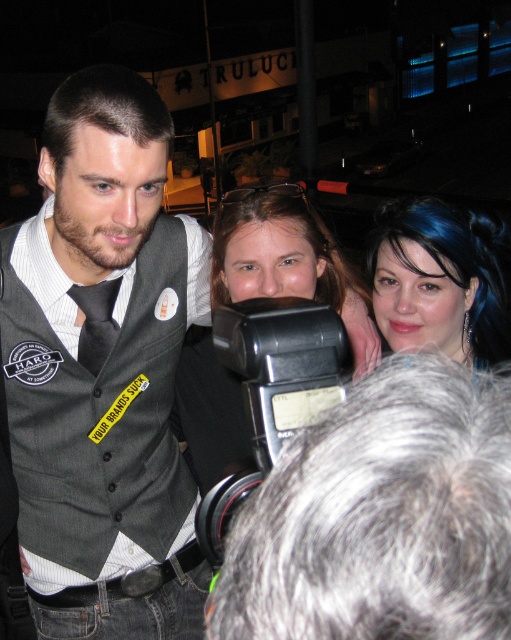
Question: Which of the following is the farthest from the observer?

Choices:
 (A) gray hair at center
 (B) gray fabric vest at center

Answer: (B)

Question: Does matte black camera at center come behind dark gray silk tie at center?

Choices:
 (A) no
 (B) yes

Answer: (A)

Question: Does gray fabric vest at center have a smaller size compared to blue hair at upper right?

Choices:
 (A) yes
 (B) no

Answer: (B)

Question: Which object is farther from the camera taking this photo?

Choices:
 (A) blue hair at upper right
 (B) dark gray silk tie at center
 (C) gray fabric vest at center
 (D) gray hair at center

Answer: (B)

Question: Can you confirm if gray hair at center is wider than blue hair at upper right?

Choices:
 (A) yes
 (B) no

Answer: (B)

Question: Considering the real-world distances, which object is closest to the black plastic video camera at center?

Choices:
 (A) dark gray silk tie at center
 (B) gray hair at center
 (C) gray fabric vest at center
 (D) blue hair at upper right

Answer: (B)